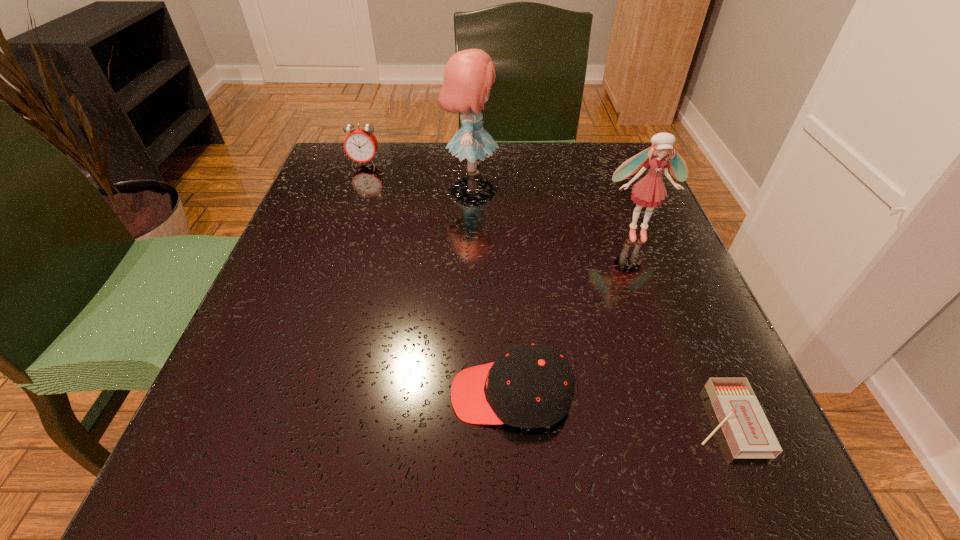
The image size is (960, 540). In the image, there is a desktop. Find the location of `free region at the far right corner`. free region at the far right corner is located at coordinates (584, 157).

Locate an element on the screen. Image resolution: width=960 pixels, height=540 pixels. free point between the shortest object and the second tallest object is located at coordinates (680, 327).

Where is `unoccupied area between the shortest object and the tallest object`? The height and width of the screenshot is (540, 960). unoccupied area between the shortest object and the tallest object is located at coordinates (598, 295).

Where is `free space between the leftmost object and the farther doll`? The height and width of the screenshot is (540, 960). free space between the leftmost object and the farther doll is located at coordinates (418, 166).

Image resolution: width=960 pixels, height=540 pixels. Identify the location of free space between the shortest object and the third shortest object. (544, 292).

I want to click on empty space that is in between the shortest object and the right doll, so click(x=680, y=327).

Where is `free point between the left doll and the second shortest object`? free point between the left doll and the second shortest object is located at coordinates (492, 282).

Where is `free space between the alarm clock and the farther doll`? The width and height of the screenshot is (960, 540). free space between the alarm clock and the farther doll is located at coordinates (418, 166).

This screenshot has width=960, height=540. I want to click on free space between the fourth tallest object and the taller doll, so click(x=492, y=282).

At what (x,y) coordinates should I click in order to perform the action: click on vacant space that is in between the fourth tallest object and the shortest object. Please return your answer as a coordinate pair (x, y). Looking at the image, I should click on click(x=618, y=407).